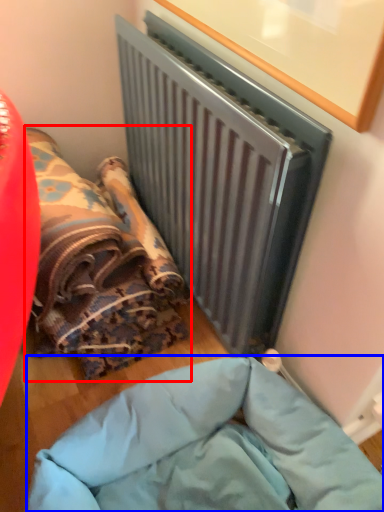
Question: Which of the following is the closest to the observer, bean bag chair (highlighted by a red box) or furniture (highlighted by a blue box)?

Choices:
 (A) bean bag chair
 (B) furniture

Answer: (B)